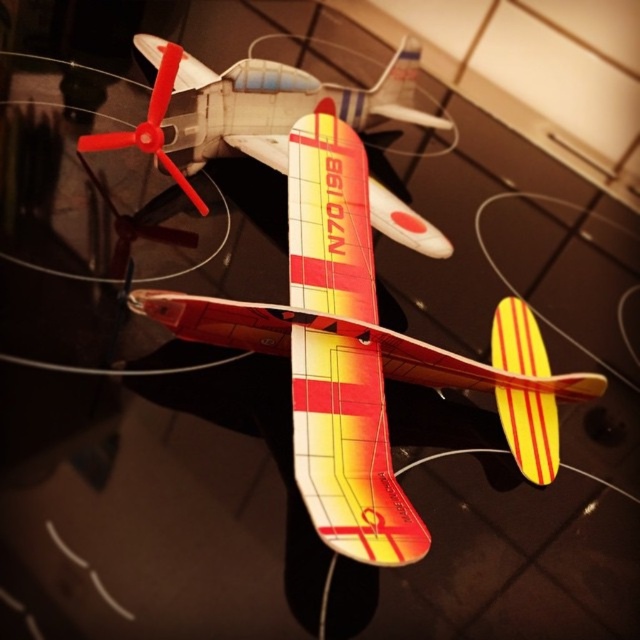
Is matte plastic airplane at center to the left of shiny red airplane at center from the viewer's perspective?

In fact, matte plastic airplane at center is to the right of shiny red airplane at center.

Who is positioned more to the left, matte plastic airplane at center or shiny red airplane at center?

shiny red airplane at center is more to the left.

The width and height of the screenshot is (640, 640). What do you see at coordinates (364, 356) in the screenshot? I see `matte plastic airplane at center` at bounding box center [364, 356].

Locate an element on the screen. This screenshot has width=640, height=640. matte plastic airplane at center is located at coordinates (364, 356).

Which is in front, point (403, 104) or point (148, 145)?

Point (148, 145) is more forward.

Is shiny red airplane at center closer to the viewer compared to red plastic propeller at center?

That is False.

I want to click on shiny red airplane at center, so click(250, 108).

Is matte plastic airplane at center positioned before red plastic propeller at center?

Yes, matte plastic airplane at center is closer to the viewer.

Between point (512, 301) and point (154, 134), which one is positioned in front?

Point (154, 134) is in front.

Which is behind, point (362, 465) or point (166, 154)?

Point (166, 154)

Identify the location of matte plastic airplane at center. (364, 356).